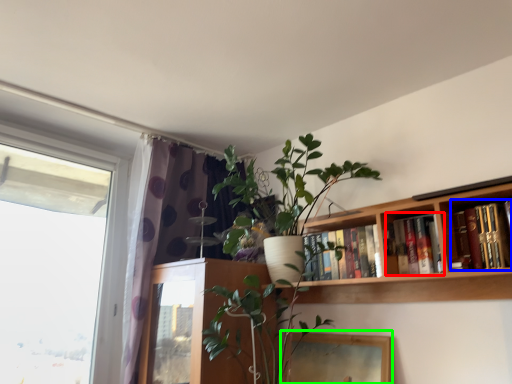
Question: Based on their relative distances, which object is farther from book (highlighted by a red box)? Choose from book (highlighted by a blue box) and picture frame (highlighted by a green box).

Choices:
 (A) book
 (B) picture frame

Answer: (B)